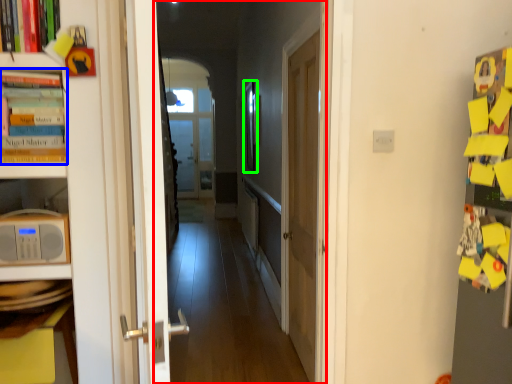
Question: Which is farther away from corridor (highlighted by a red box)? book (highlighted by a blue box) or picture frame (highlighted by a green box)?

Choices:
 (A) book
 (B) picture frame

Answer: (A)